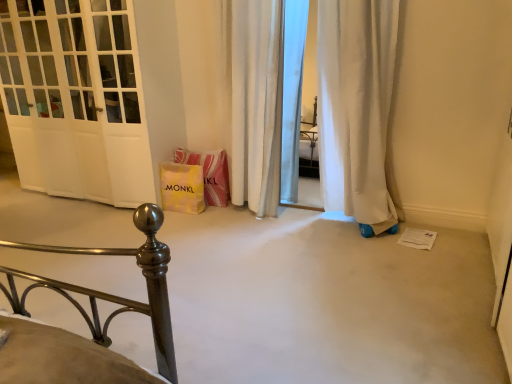
The image size is (512, 384). Identify the location of unoccupied area in front of white glossy door at left. (88, 237).